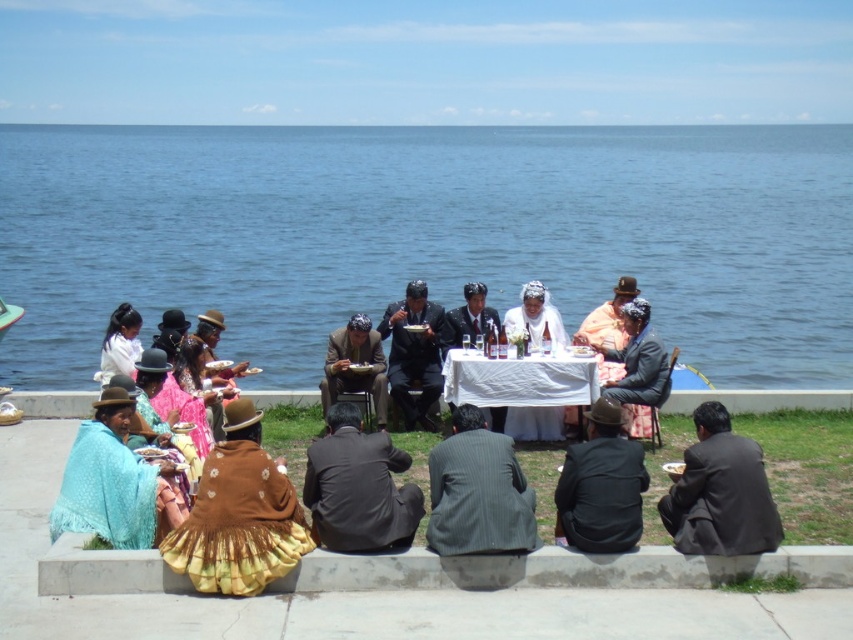
Question: Which of the following is the closest to the observer?

Choices:
 (A) blue water at center
 (B) gray pinstripe suit at center
 (C) dark brown suit at center

Answer: (B)

Question: Which point appears farthest from the camera in this image?

Choices:
 (A) (752, 474)
 (B) (378, 374)
 (C) (590, 465)
 (D) (115, 486)

Answer: (B)

Question: Which point is closer to the camera?

Choices:
 (A) knitted teal shawl at lower left
 (B) matte brown suit at center
 (C) matte orange shirt at center
 (D) blue water at center

Answer: (A)

Question: Is blue water at center positioned behind knitted teal shawl at lower left?

Choices:
 (A) yes
 (B) no

Answer: (A)

Question: Is dark brown suit at center bigger than matte orange shirt at center?

Choices:
 (A) no
 (B) yes

Answer: (A)

Question: Is gray pinstripe suit at center behind matte brown suit at center?

Choices:
 (A) yes
 (B) no

Answer: (B)